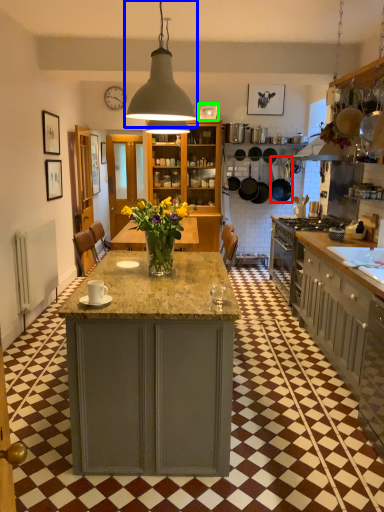
Question: Which object is the closest to the frying pan (highlighted by a red box)? Choose among these: light fixture (highlighted by a blue box) or picture frame (highlighted by a green box).

Choices:
 (A) light fixture
 (B) picture frame

Answer: (B)